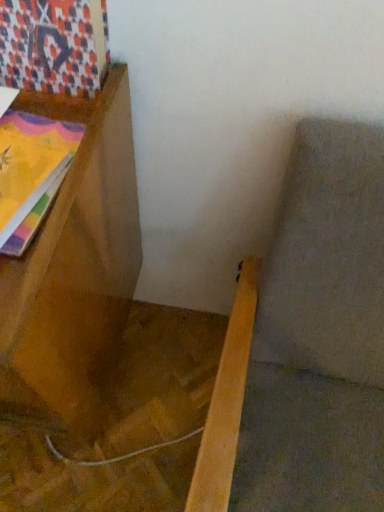
Where is `patterned fabric at upper left`? patterned fabric at upper left is located at coordinates (54, 45).

What do you see at coordinates (54, 45) in the screenshot?
I see `patterned fabric at upper left` at bounding box center [54, 45].

The height and width of the screenshot is (512, 384). Describe the element at coordinates (74, 270) in the screenshot. I see `wooden bookshelf at left` at that location.

At what (x,y) coordinates should I click in order to perform the action: click on wooden bookshelf at left. Please return your answer as a coordinate pair (x, y). The width and height of the screenshot is (384, 512). Looking at the image, I should click on (74, 270).

This screenshot has height=512, width=384. What are the coordinates of `patterned fabric at upper left` in the screenshot? It's located at (54, 45).

Would you say patterned fabric at upper left is to the left or to the right of wooden bookshelf at left in the picture?

In the image, patterned fabric at upper left appears on the right side of wooden bookshelf at left.

Is the position of patterned fabric at upper left less distant than that of wooden bookshelf at left?

No, patterned fabric at upper left is behind wooden bookshelf at left.

Is point (53, 41) positioned in front of point (88, 308)?

Yes, point (53, 41) is closer to viewer.

From the image's perspective, is patterned fabric at upper left located above or below wooden bookshelf at left?

Clearly, from the image's perspective, patterned fabric at upper left is above wooden bookshelf at left.

From a real-world perspective, is patterned fabric at upper left on top of wooden bookshelf at left?

Yes, from a real-world perspective, patterned fabric at upper left is on top of wooden bookshelf at left.

Does patterned fabric at upper left have a lesser width compared to wooden bookshelf at left?

Yes, patterned fabric at upper left is thinner than wooden bookshelf at left.

From their relative heights in the image, would you say patterned fabric at upper left is taller or shorter than wooden bookshelf at left?

Clearly, patterned fabric at upper left is shorter compared to wooden bookshelf at left.

Considering the relative sizes of patterned fabric at upper left and wooden bookshelf at left in the image provided, is patterned fabric at upper left bigger than wooden bookshelf at left?

No, patterned fabric at upper left is not bigger than wooden bookshelf at left.

Can we say patterned fabric at upper left lies outside wooden bookshelf at left?

That's correct, patterned fabric at upper left is outside of wooden bookshelf at left.

Is patterned fabric at upper left beside wooden bookshelf at left?

No, patterned fabric at upper left is not in contact with wooden bookshelf at left.

Is patterned fabric at upper left turned away from wooden bookshelf at left?

No, patterned fabric at upper left's orientation is not away from wooden bookshelf at left.

At what (x,y) coordinates should I click in order to perform the action: click on tapestry that is above the wooden bookshelf at left (from the image's perspective). Please return your answer as a coordinate pair (x, y). This screenshot has height=512, width=384. Looking at the image, I should click on (54, 45).

Between wooden bookshelf at left and patterned fabric at upper left, which one appears on the right side from the viewer's perspective?

From the viewer's perspective, patterned fabric at upper left appears more on the right side.

Looking at this image, considering the relative positions of wooden bookshelf at left and patterned fabric at upper left in the image provided, is wooden bookshelf at left behind patterned fabric at upper left?

No, wooden bookshelf at left is closer to the camera.

Does point (38, 255) appear closer or farther from the camera than point (77, 48)?

Point (38, 255) is positioned closer to the camera compared to point (77, 48).

From the image's perspective, between wooden bookshelf at left and patterned fabric at upper left, which one is located above?

patterned fabric at upper left, from the image's perspective.

From a real-world perspective, which object rests below the other?

wooden bookshelf at left, from a real-world perspective.

Is wooden bookshelf at left thinner than patterned fabric at upper left?

In fact, wooden bookshelf at left might be wider than patterned fabric at upper left.

In the scene shown: Does wooden bookshelf at left have a greater height compared to patterned fabric at upper left?

Yes.

Does wooden bookshelf at left have a smaller size compared to patterned fabric at upper left?

Incorrect, wooden bookshelf at left is not smaller in size than patterned fabric at upper left.

Would you say patterned fabric at upper left is part of wooden bookshelf at left's contents?

No, patterned fabric at upper left is not a part of wooden bookshelf at left.

Is wooden bookshelf at left not near patterned fabric at upper left?

They are positioned close to each other.

Is wooden bookshelf at left facing towards patterned fabric at upper left?

No.

What's the angular difference between wooden bookshelf at left and patterned fabric at upper left's facing directions?

wooden bookshelf at left and patterned fabric at upper left are facing 0.42 degrees away from each other.

How distant is wooden bookshelf at left from patterned fabric at upper left?

wooden bookshelf at left is 10.07 inches from patterned fabric at upper left.

At what (x,y) coordinates should I click in order to perform the action: click on tapestry that is above the wooden bookshelf at left (from the image's perspective). Please return your answer as a coordinate pair (x, y). Looking at the image, I should click on (54, 45).

This screenshot has width=384, height=512. I want to click on furniture directly beneath the patterned fabric at upper left (from a real-world perspective), so click(74, 270).

Where is `tapestry above the wooden bookshelf at left (from a real-world perspective)`? This screenshot has height=512, width=384. tapestry above the wooden bookshelf at left (from a real-world perspective) is located at coordinates (54, 45).